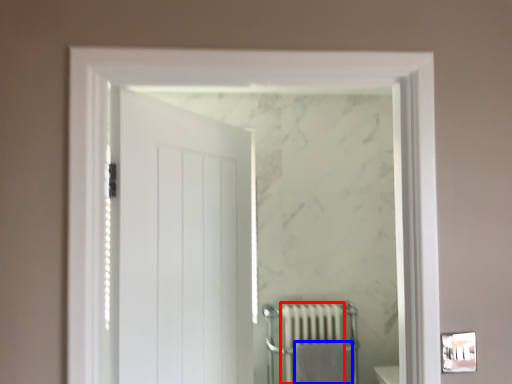
Question: Which point is closer to the camera, radiator (highlighted by a red box) or bath towel (highlighted by a blue box)?

Choices:
 (A) radiator
 (B) bath towel

Answer: (B)